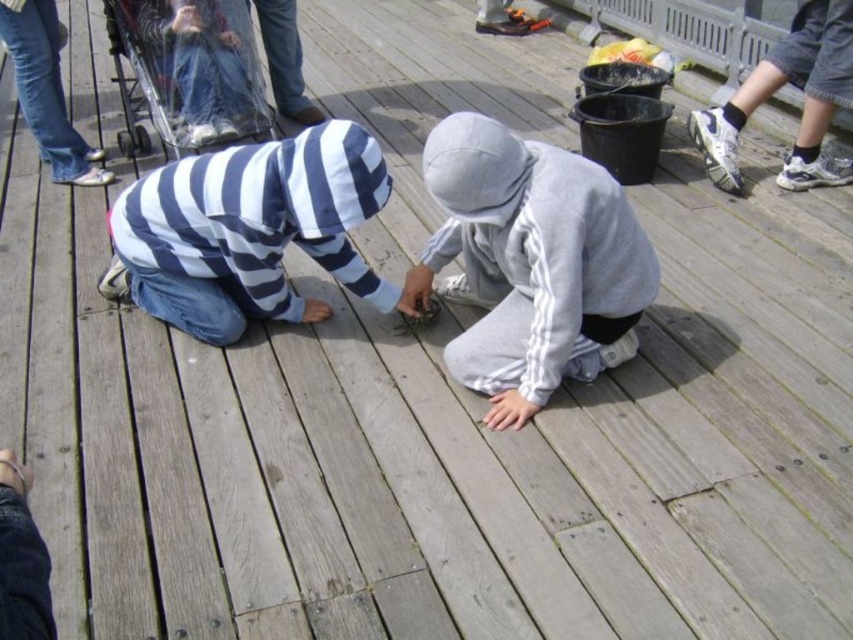
Question: Which of the following is the farthest from the observer?

Choices:
 (A) (630, 314)
 (B) (276, 227)

Answer: (B)

Question: Does gray fleece hoodie at center lie in front of striped hoodie at center?

Choices:
 (A) no
 (B) yes

Answer: (B)

Question: Is gray fleece hoodie at center closer to the viewer compared to striped hoodie at center?

Choices:
 (A) no
 (B) yes

Answer: (B)

Question: Is gray fleece hoodie at center positioned at the back of striped hoodie at center?

Choices:
 (A) yes
 (B) no

Answer: (B)